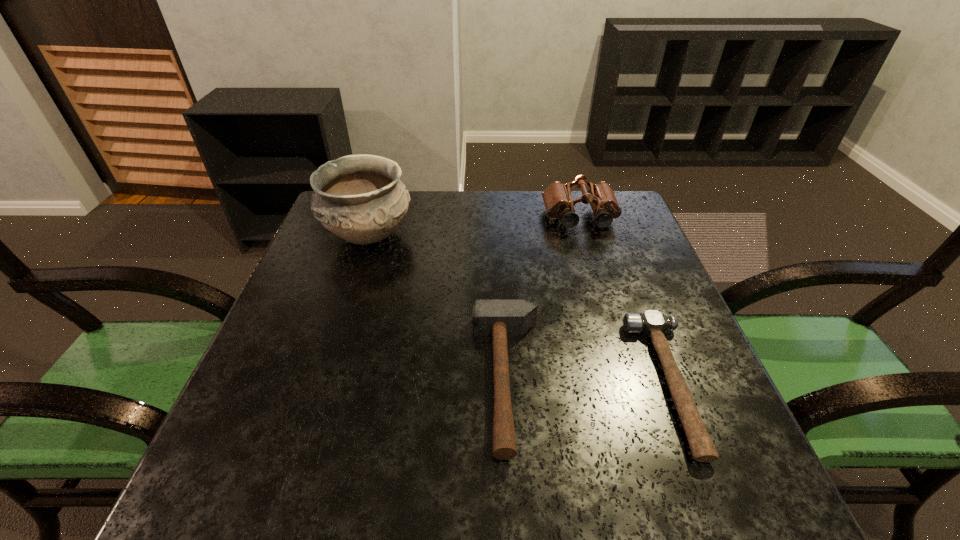
This screenshot has width=960, height=540. In order to click on free space located on the striking surface of the taller hammer in this screenshot , I will do `click(384, 380)`.

The height and width of the screenshot is (540, 960). I want to click on free space located 0.330m on the striking surface of the taller hammer, so click(x=300, y=380).

Where is `vacant area situated on the striking face of the shorter hammer`? This screenshot has width=960, height=540. vacant area situated on the striking face of the shorter hammer is located at coordinates (490, 383).

You are a GUI agent. You are given a task and a screenshot of the screen. Output one action in this format:
    pyautogui.click(x=<x>, y=<y>)
    Task: Click on the free location located on the striking face of the shorter hammer
    
    Given the screenshot: What is the action you would take?
    pyautogui.click(x=605, y=383)

Image resolution: width=960 pixels, height=540 pixels. In order to click on vacant area situated 0.230m on the striking face of the shorter hammer in this screenshot , I will do `click(520, 383)`.

You are a GUI agent. You are given a task and a screenshot of the screen. Output one action in this format:
    pyautogui.click(x=<x>, y=<y>)
    Task: Click on the pottery present at the far edge
    The width and height of the screenshot is (960, 540).
    Given the screenshot: What is the action you would take?
    pyautogui.click(x=360, y=198)

Where is `binoculars located at the far edge`? binoculars located at the far edge is located at coordinates (557, 198).

Locate an element on the screen. object that is at the left edge is located at coordinates (360, 198).

Locate an element on the screen. This screenshot has height=540, width=960. binoculars that is at the right edge is located at coordinates (557, 198).

The width and height of the screenshot is (960, 540). I want to click on hammer positioned at the right edge, so click(x=652, y=322).